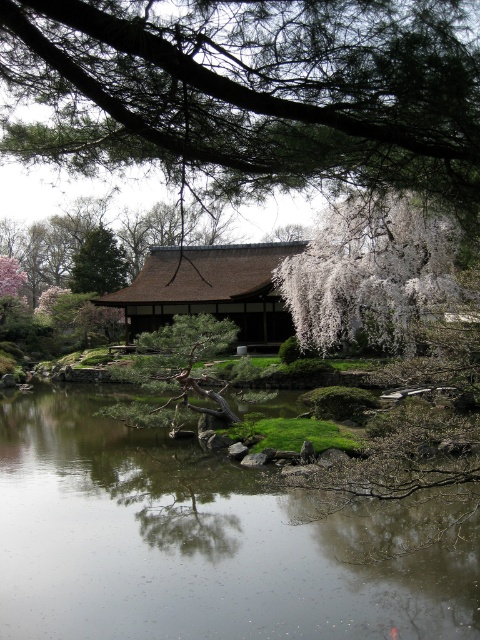
Image resolution: width=480 pixels, height=640 pixels. I want to click on transparent water at center, so pos(211,540).

Is transparent water at center above green textured pine branch at upper center?

No.

Is point (67, 570) positioned before point (469, 141)?

No.

Identify the location of transparent water at center. (211, 540).

Does transparent water at center have a lesser height compared to green leafy tree at upper left?

Yes, transparent water at center is shorter than green leafy tree at upper left.

Which is behind, point (302, 534) or point (81, 257)?

The point (81, 257) is behind.

Which is behind, point (394, 634) or point (81, 282)?

The point (81, 282) is more distant.

Image resolution: width=480 pixels, height=640 pixels. In order to click on transparent water at center in this screenshot , I will do `click(211, 540)`.

Is transparent water at center bigger than white blossoming tree at center?

Actually, transparent water at center might be smaller than white blossoming tree at center.

Who is lower down, transparent water at center or white blossoming tree at center?

transparent water at center

Which is behind, point (208, 548) or point (300, 314)?

The point (300, 314) is behind.

This screenshot has width=480, height=640. What are the coordinates of `transparent water at center` in the screenshot? It's located at (211, 540).